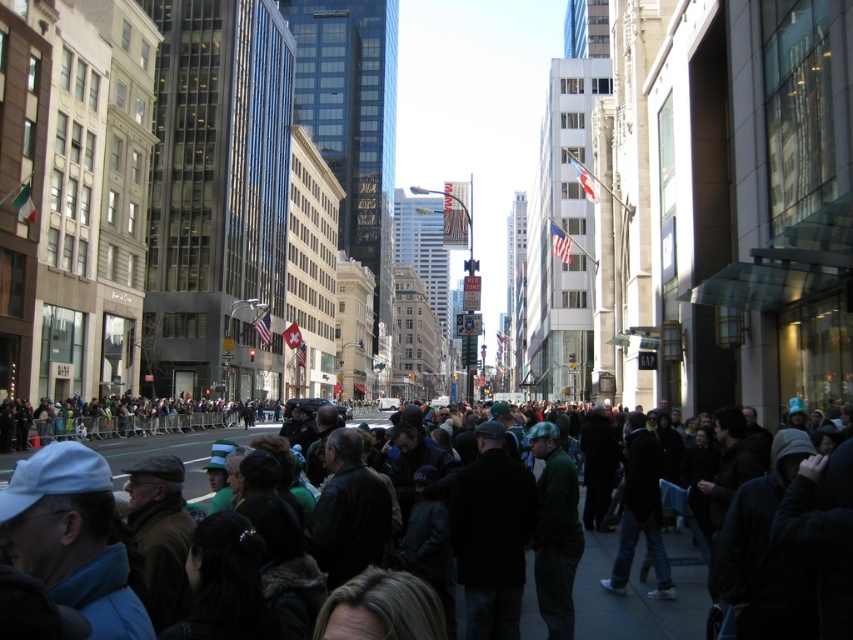
You are a photographer standing on the sidewalk and want to take a photo of the dark clothing crowd at center and the dark green fabric crowd at lower left. Which crowd should you focus on to capture more people in the foreground?

The dark clothing crowd at center is much taller than the dark green fabric crowd at lower left, so focusing on the dark clothing crowd at center will allow you to capture more people in the foreground.

You are a photographer standing on the sidewalk and want to capture both the dark clothing crowd at center and the dark green fabric crowd at lower left in a single shot. Which crowd should you focus on first to ensure both are in frame?

The dark clothing crowd at center is positioned under the dark green fabric crowd at lower left, so you should focus on the dark green fabric crowd at lower left first to ensure both are in frame.